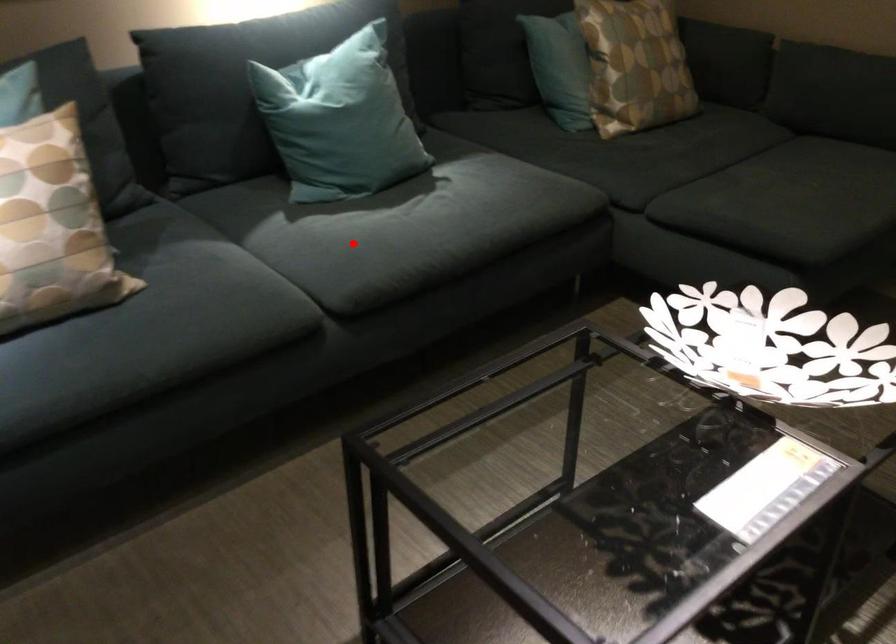
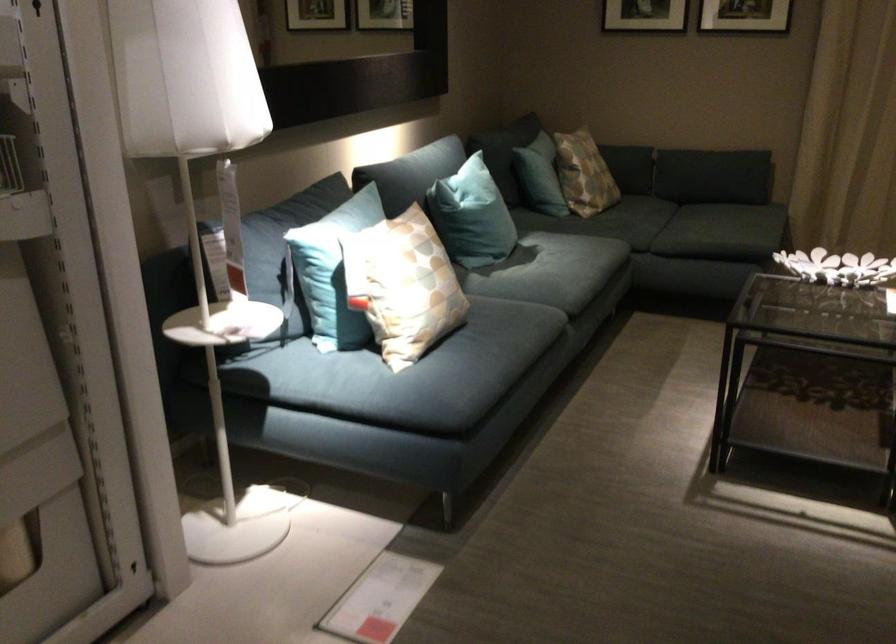
Question: I am providing you with two images of the same scene from different viewpoints. A red point is shown in image1. For the corresponding object point in image2, is it positioned nearer or farther from the camera?

Choices:
 (A) Nearer
 (B) Farther

Answer: (B)